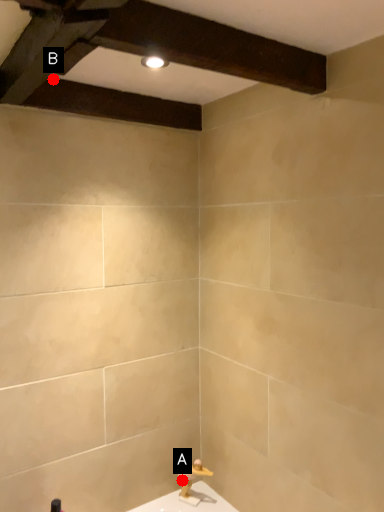
Question: Two points are circled on the image, labeled by A and B beside each circle. Among these points, which one is farthest from the camera?

Choices:
 (A) A is further
 (B) B is further

Answer: (A)